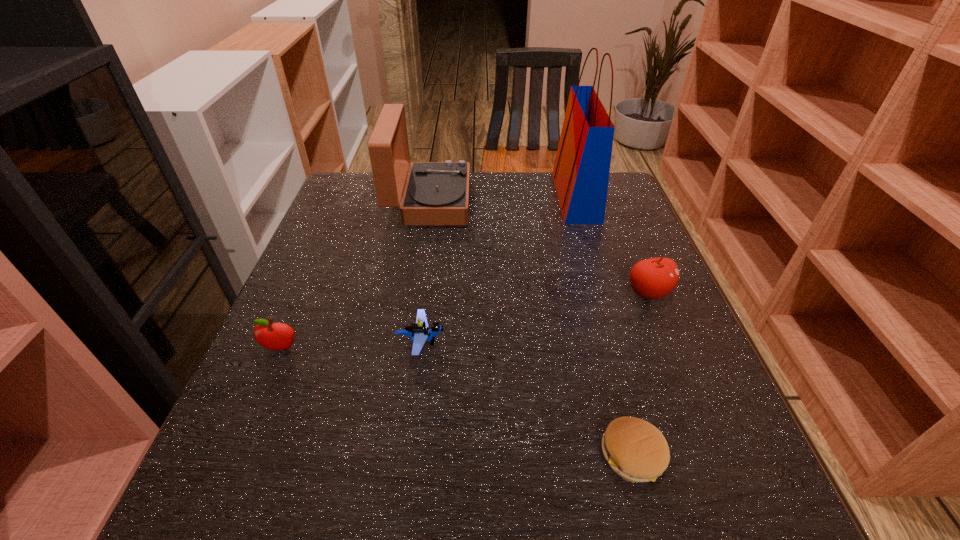
This screenshot has width=960, height=540. Find the location of `the second closest object to the second tallest object`. the second closest object to the second tallest object is located at coordinates (419, 332).

Locate which object is the fifth closest to the tallest object. Please provide its 2D coordinates. Your answer should be formatted as a tuple, i.e. [(x, y)], where the tuple contains the x and y coordinates of a point satisfying the conditions above.

[(274, 336)]

Where is `free space in the image that satisfies the following two spatial constraints: 1. on the face of the patty; 2. on the left side of the fifth shortest object`? This screenshot has width=960, height=540. free space in the image that satisfies the following two spatial constraints: 1. on the face of the patty; 2. on the left side of the fifth shortest object is located at coordinates (391, 455).

Locate an element on the screen. This screenshot has width=960, height=540. free spot that satisfies the following two spatial constraints: 1. on the handle side of the shopping bag; 2. on the back side of the right apple is located at coordinates pos(605,293).

You are a GUI agent. You are given a task and a screenshot of the screen. Output one action in this format:
    pyautogui.click(x=<x>, y=<y>)
    Task: Click on the vacant space that satisfies the following two spatial constraints: 1. on the handle side of the tallest object; 2. on the back side of the third farthest object
    The width and height of the screenshot is (960, 540).
    Given the screenshot: What is the action you would take?
    pyautogui.click(x=605, y=293)